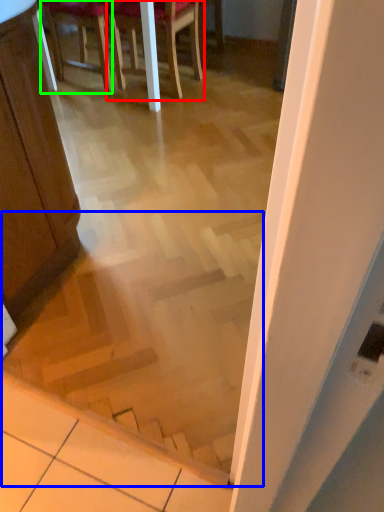
Question: Based on their relative distances, which object is nearer to chair (highlighted by a red box)? Choose from stairwell (highlighted by a blue box) and chair (highlighted by a green box).

Choices:
 (A) stairwell
 (B) chair

Answer: (B)